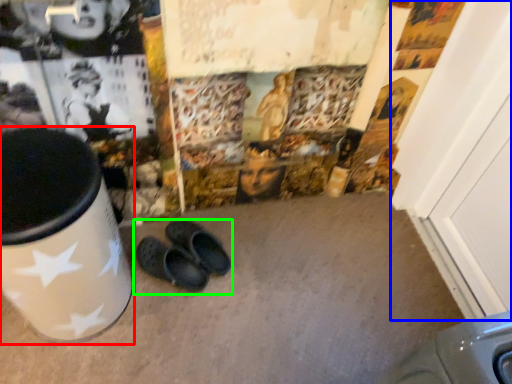
Question: Considering the real-world distances, which object is farthest from waste container (highlighted by a red box)? door (highlighted by a blue box) or footwear (highlighted by a green box)?

Choices:
 (A) door
 (B) footwear

Answer: (A)